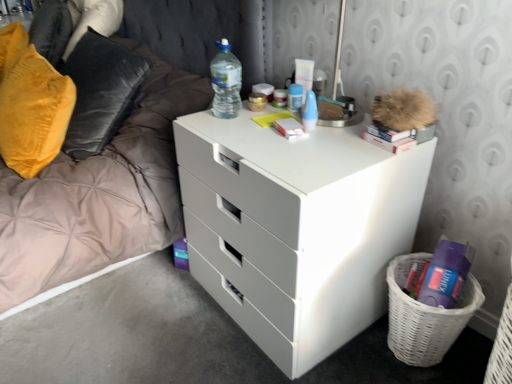
Identify the location of vacant space in front of hardcover book at upper right, arranged as the second book when viewed from the left. (366, 159).